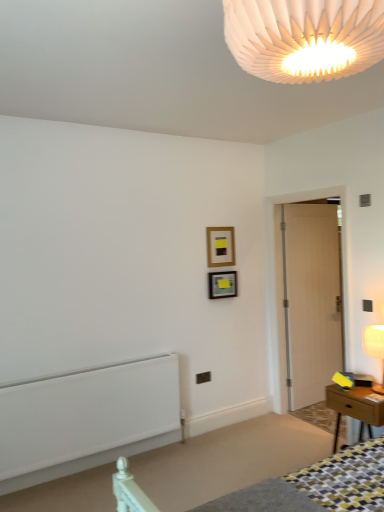
Question: Does wooden picture frame at upper center, the 2th picture frame ordered from the bottom, have a smaller size compared to wooden table at right?

Choices:
 (A) yes
 (B) no

Answer: (A)

Question: From a real-world perspective, is wooden picture frame at upper center, the 2th picture frame ordered from the bottom, physically below wooden table at right?

Choices:
 (A) no
 (B) yes

Answer: (A)

Question: Is wooden table at right completely or partially inside wooden picture frame at upper center, the 2th picture frame ordered from the bottom?

Choices:
 (A) yes
 (B) no

Answer: (B)

Question: From a real-world perspective, is wooden picture frame at upper center, acting as the 1th picture frame starting from the top, physically above wooden table at right?

Choices:
 (A) yes
 (B) no

Answer: (A)

Question: Can you confirm if wooden picture frame at upper center, the 2th picture frame ordered from the bottom, is thinner than wooden table at right?

Choices:
 (A) yes
 (B) no

Answer: (A)

Question: Would you say white pleated paper lampshade at upper center, which appears as the 2th lamp when ordered from the bottom, is inside or outside metallic silver picture frame at upper center, positioned as the 2th picture frame in top-to-bottom order?

Choices:
 (A) inside
 (B) outside

Answer: (B)

Question: Looking at their shapes, would you say white pleated paper lampshade at upper center, marked as the 1th lamp in a top-to-bottom arrangement, is wider or thinner than metallic silver picture frame at upper center, positioned as the 2th picture frame in top-to-bottom order?

Choices:
 (A) wide
 (B) thin

Answer: (A)

Question: From a real-world perspective, is white pleated paper lampshade at upper center, which is the second lamp from back to front, physically located above or below metallic silver picture frame at upper center, arranged as the 1th picture frame when ordered from the bottom?

Choices:
 (A) above
 (B) below

Answer: (A)

Question: Is white pleated paper lampshade at upper center, which is the second lamp from back to front, to the left or to the right of metallic silver picture frame at upper center, positioned as the 2th picture frame in top-to-bottom order, in the image?

Choices:
 (A) left
 (B) right

Answer: (A)

Question: Based on their sizes in the image, would you say metallic silver picture frame at upper center, positioned as the 2th picture frame in top-to-bottom order, is bigger or smaller than wooden picture frame at upper center, the 2th picture frame ordered from the bottom?

Choices:
 (A) small
 (B) big

Answer: (B)

Question: From a real-world perspective, is metallic silver picture frame at upper center, positioned as the 2th picture frame in top-to-bottom order, positioned above or below wooden picture frame at upper center, the 2th picture frame ordered from the bottom?

Choices:
 (A) below
 (B) above

Answer: (A)

Question: Choose the correct answer: Is metallic silver picture frame at upper center, positioned as the 2th picture frame in top-to-bottom order, inside wooden picture frame at upper center, the 2th picture frame ordered from the bottom, or outside it?

Choices:
 (A) outside
 (B) inside

Answer: (A)

Question: From the image's perspective, is metallic silver picture frame at upper center, arranged as the 1th picture frame when ordered from the bottom, located above or below wooden picture frame at upper center, acting as the 1th picture frame starting from the top?

Choices:
 (A) below
 (B) above

Answer: (A)

Question: From a real-world perspective, is matte white lampshade at right, the second lamp when ordered from left to right, positioned above or below wooden table at right?

Choices:
 (A) below
 (B) above

Answer: (B)

Question: Choose the correct answer: Is matte white lampshade at right, the second lamp viewed from the top, inside wooden table at right or outside it?

Choices:
 (A) inside
 (B) outside

Answer: (B)